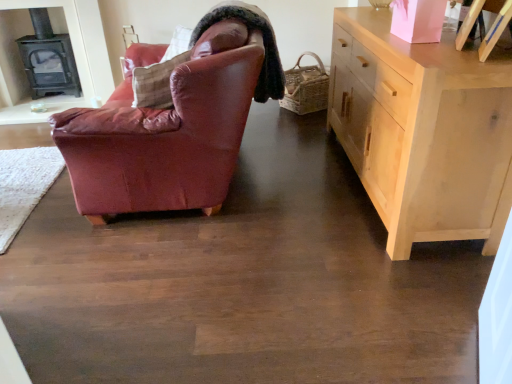
Identify the location of vacant region to the left of light wood cabinet at right. The image size is (512, 384). (238, 236).